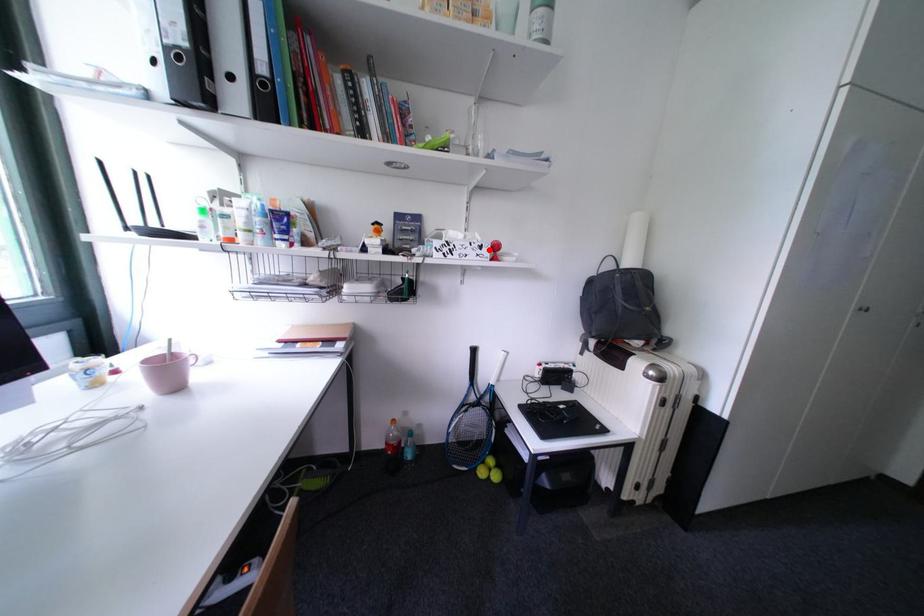
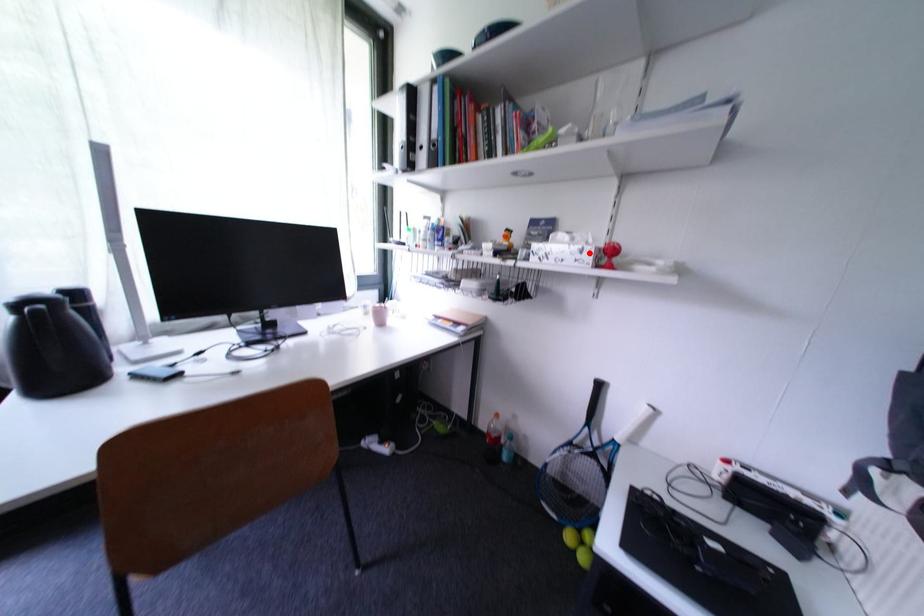
In the scene shown: I am providing you with two images of the same scene from different viewpoints. A red point is marked on the first image and another point is marked on the second image. Is the red point in image1 aligned with the point shown in image2?

Yes